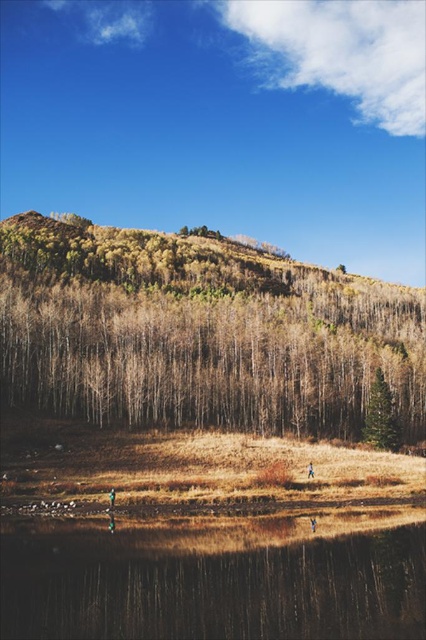
Who is lower down, brown textured trees at upper center or blue fabric person at lower center?

Positioned lower is blue fabric person at lower center.

Is point (115, 400) farther from camera compared to point (310, 522)?

Yes, point (115, 400) is behind point (310, 522).

The height and width of the screenshot is (640, 426). Describe the element at coordinates (198, 333) in the screenshot. I see `brown textured trees at upper center` at that location.

The height and width of the screenshot is (640, 426). In order to click on brown textured trees at upper center in this screenshot , I will do `click(198, 333)`.

Is green matte tree at right to the right of green fabric person at lower center from the viewer's perspective?

Indeed, green matte tree at right is positioned on the right side of green fabric person at lower center.

Who is shorter, green matte tree at right or green fabric person at lower center?

green fabric person at lower center is shorter.

Which is in front, point (368, 422) or point (112, 492)?

Point (112, 492)

Locate an element on the screen. green matte tree at right is located at coordinates (380, 416).

How much distance is there between transparent glass water at lower center and brown leather jacket at lower center?

A distance of 36.14 meters exists between transparent glass water at lower center and brown leather jacket at lower center.

Can you confirm if transparent glass water at lower center is positioned to the right of brown leather jacket at lower center?

Incorrect, transparent glass water at lower center is not on the right side of brown leather jacket at lower center.

At what (x,y) coordinates should I click in order to perform the action: click on transparent glass water at lower center. Please return your answer as a coordinate pair (x, y). This screenshot has width=426, height=640. Looking at the image, I should click on (210, 586).